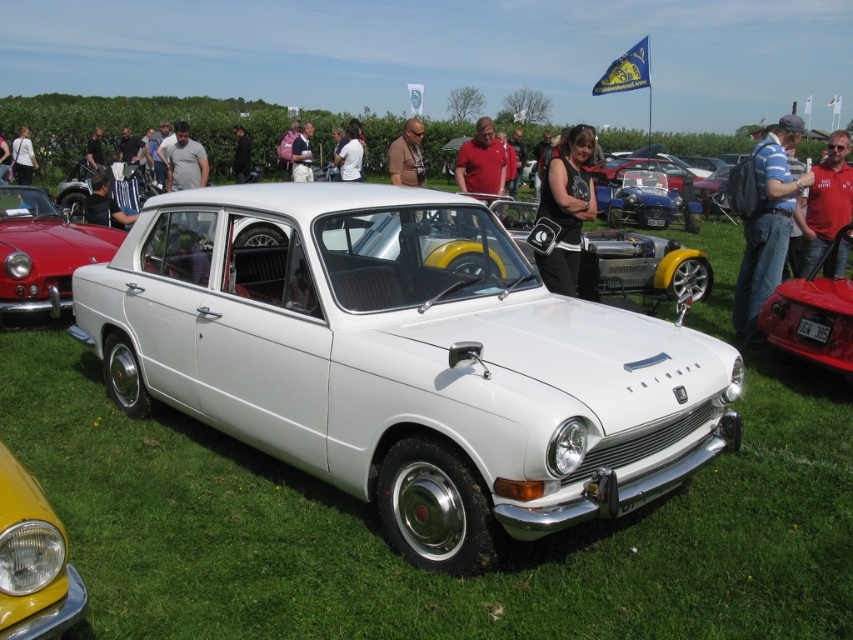
Is white metallic sedan at center behind red smooth shirt at center?

No, white metallic sedan at center is closer to the viewer.

Can you confirm if white metallic sedan at center is positioned to the right of red smooth shirt at center?

Incorrect, white metallic sedan at center is not on the right side of red smooth shirt at center.

Does point (735, 432) come closer to viewer compared to point (485, 184)?

Yes, point (735, 432) is closer to viewer.

This screenshot has width=853, height=640. Identify the location of white metallic sedan at center. (403, 360).

Who is lower down, white fabric shirt at center or white cotton shirt at center?

white fabric shirt at center

Can you confirm if white fabric shirt at center is positioned to the left of white cotton shirt at center?

Incorrect, white fabric shirt at center is not on the left side of white cotton shirt at center.

The height and width of the screenshot is (640, 853). Find the location of `white fabric shirt at center`. white fabric shirt at center is located at coordinates (350, 156).

Can you confirm if light brown leather jacket at center is bigger than matte black jacket at center?

Incorrect, light brown leather jacket at center is not larger than matte black jacket at center.

Consider the image. Can you confirm if light brown leather jacket at center is taller than matte black jacket at center?

No, light brown leather jacket at center is not taller than matte black jacket at center.

Does point (292, 164) come farther from viewer compared to point (9, 164)?

No.

Find the location of `light brown leather jacket at center`. light brown leather jacket at center is located at coordinates (302, 154).